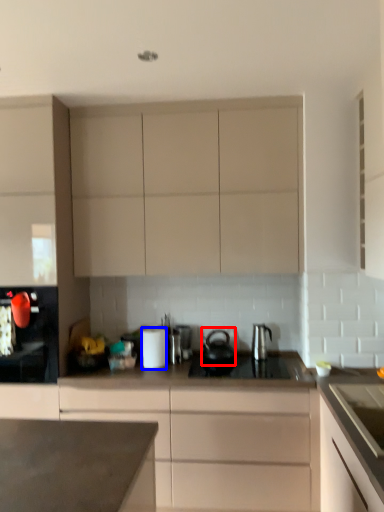
Question: Which object is further to the camera taking this photo, tea pot (highlighted by a red box) or kitchen appliance (highlighted by a blue box)?

Choices:
 (A) tea pot
 (B) kitchen appliance

Answer: (A)